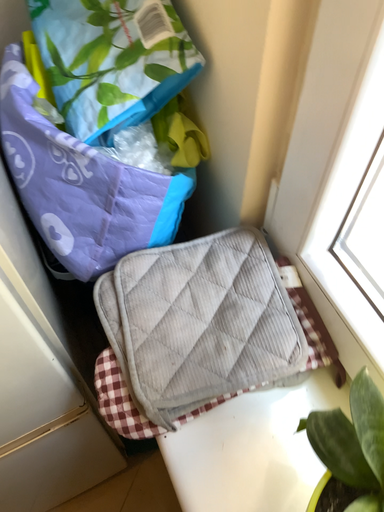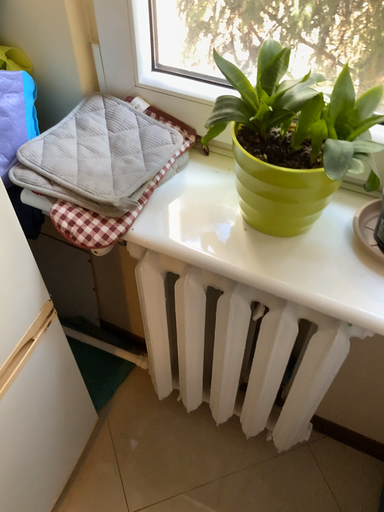
Question: How did the camera likely rotate when shooting the video?

Choices:
 (A) rotated left
 (B) rotated right

Answer: (B)